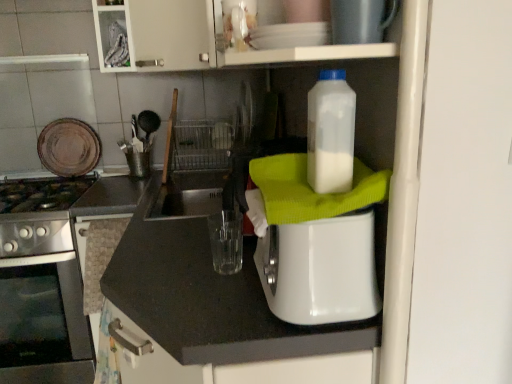
The image size is (512, 384). I want to click on vacant point to the left of brown matte plate at upper left, which is the third appliance in front-to-back order, so click(x=33, y=178).